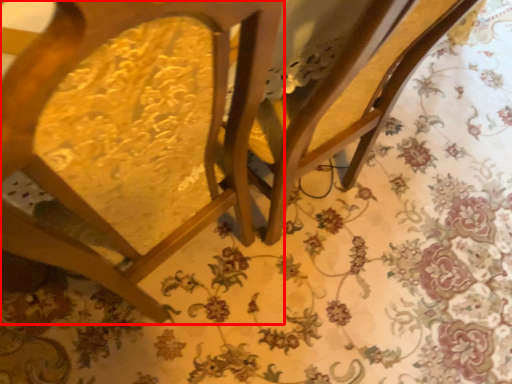
Question: From the image, what is the correct spatial relationship of chair (annotated by the red box) in relation to swivel chair?

Choices:
 (A) right
 (B) left

Answer: (B)